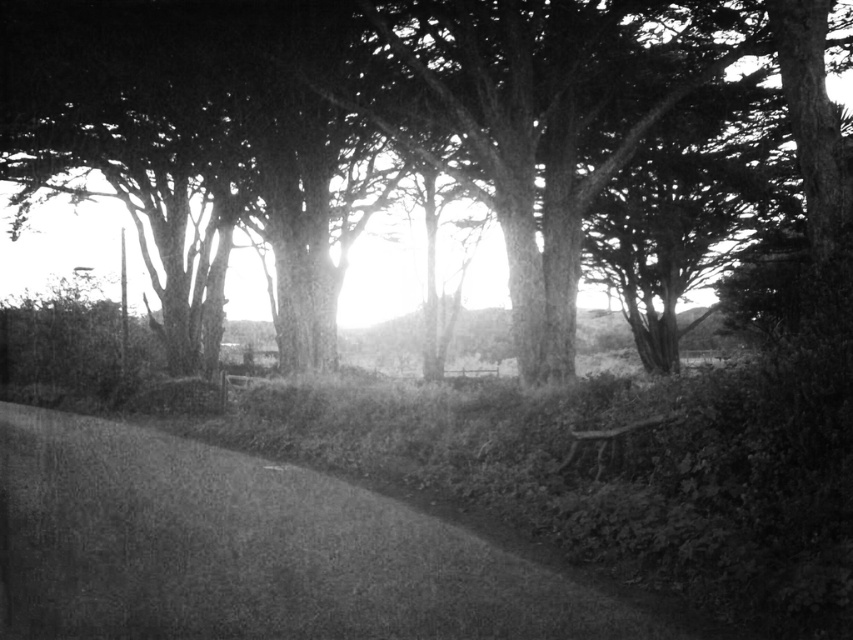
You are a gardener planning to place a new wooden park bench at lower right along the gravelly path at center. Based on the scene, will the bench fit along the path without overlapping it?

The gravelly path at center is wider than the wooden park bench at lower right, so the bench will fit along the path without overlapping.

You are a photographer planning to set up a tripod between the smooth bark tree at center and the wooden park bench at lower right. Based on the scene, can you determine if there is enough space between them for your tripod?

The smooth bark tree at center might be wider than wooden park bench at lower right, so there may not be enough space between them for the tripod. It is recommended to check the actual width before setting up.

You are standing at the entrance of the pathway in the scene. You want to sit on the wooden park bench at lower right. Which direction should you walk to reach it from the smooth bark tree at center?

The smooth bark tree at center is to the left of the wooden park bench at lower right. To reach the bench from the tree, you should walk to the right.